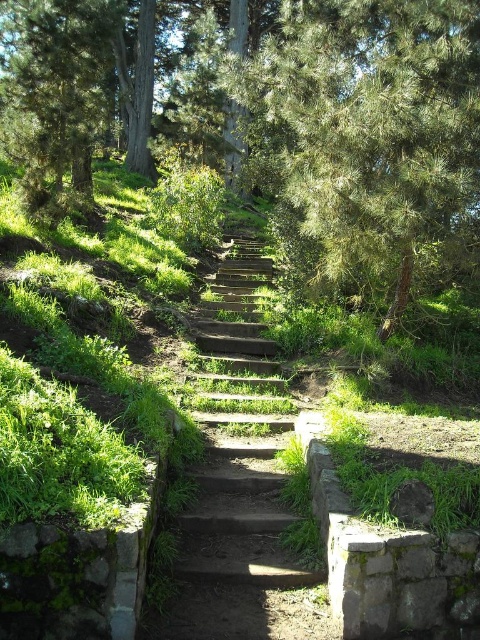
You are standing at the bottom of the wooden stairs at center and want to walk towards the green textured pine forest at center. Which direction should you face to move towards it?

You should face away from the wooden stairs at center because the green textured pine forest at center is further away from you, meaning it is located behind the stairs.

You are standing at the bottom of the stone steps and want to reach the green textured pine forest at center. Which direction should you move in to get there?

To reach the green textured pine forest at center, you should move upward along the stone steps since it is located at point [347,132], which is higher up in the scene.

You are standing on the stone steps in the image and looking towards the center. What do you see at the point marked by the coordinates (347, 132)?

At the coordinates (347, 132), you will find the green textured pine forest at center.